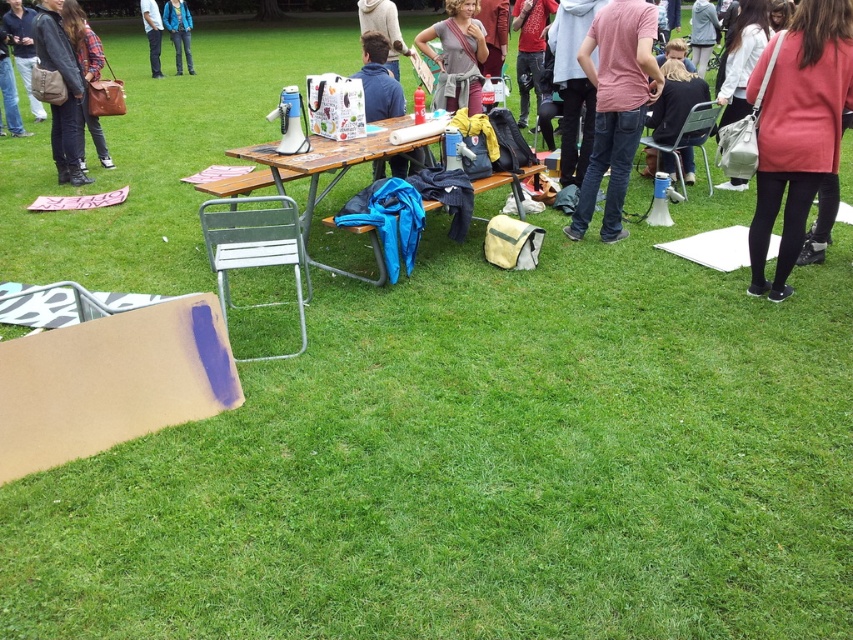
Question: Can you confirm if pink cotton t-shirt at center is thinner than leather brown bag at upper left?

Choices:
 (A) no
 (B) yes

Answer: (B)

Question: Is matte black jacket at left closer to the viewer compared to light brown leather jacket at upper center?

Choices:
 (A) yes
 (B) no

Answer: (A)

Question: Is matte brown bag at upper center above brown leather bag at left?

Choices:
 (A) no
 (B) yes

Answer: (B)

Question: Among these objects, which one is nearest to the camera?

Choices:
 (A) pink cotton t-shirt at center
 (B) light brown leather jacket at upper center
 (C) brown leather bag at left

Answer: (A)

Question: Which of the following is the farthest from the observer?

Choices:
 (A) (461, 54)
 (B) (792, 60)
 (C) (144, 8)

Answer: (C)

Question: Among these points, which one is nearest to the camera?

Choices:
 (A) (283, 189)
 (B) (483, 35)
 (C) (151, 68)

Answer: (A)